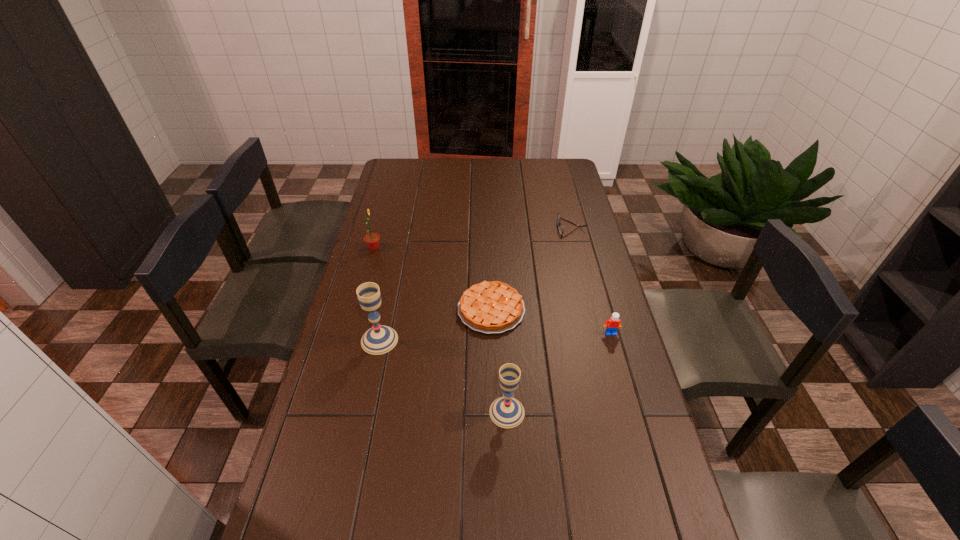
Where is `the second object from left to right`? Image resolution: width=960 pixels, height=540 pixels. the second object from left to right is located at coordinates (380, 339).

This screenshot has height=540, width=960. Identify the location of the left chalice. (380, 339).

Find the location of a particular element. This screenshot has height=540, width=960. the nearest object is located at coordinates (507, 412).

I want to click on the nearer chalice, so click(507, 412).

What are the coordinates of `sunflower` in the screenshot? It's located at point(372,240).

At what (x,y) coordinates should I click in order to perform the action: click on the leftmost object. Please return your answer as a coordinate pair (x, y). This screenshot has width=960, height=540. Looking at the image, I should click on (372, 240).

Where is `spectacles`? spectacles is located at coordinates (560, 227).

This screenshot has width=960, height=540. Find the location of `the fourth tallest object`. the fourth tallest object is located at coordinates (612, 325).

You are a GUI agent. You are given a task and a screenshot of the screen. Output one action in this format:
    pyautogui.click(x=<x>, y=<y>)
    Task: Click on the pie
    Image resolution: width=960 pixels, height=540 pixels.
    Given the screenshot: What is the action you would take?
    pyautogui.click(x=489, y=307)

The height and width of the screenshot is (540, 960). In order to click on free space located on the front of the tallest object in this screenshot , I will do `click(363, 420)`.